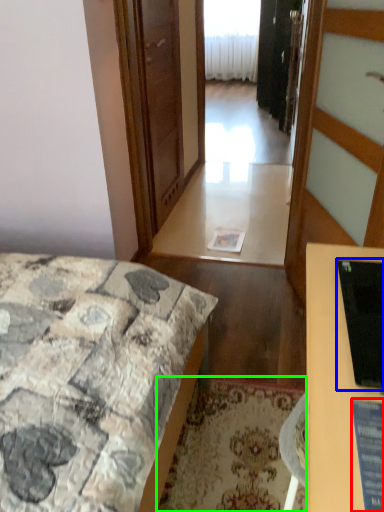
Question: Considering the real-world distances, which object is farthest from computer screen (highlighted by a red box)? computer monitor (highlighted by a blue box) or mat (highlighted by a green box)?

Choices:
 (A) computer monitor
 (B) mat

Answer: (B)